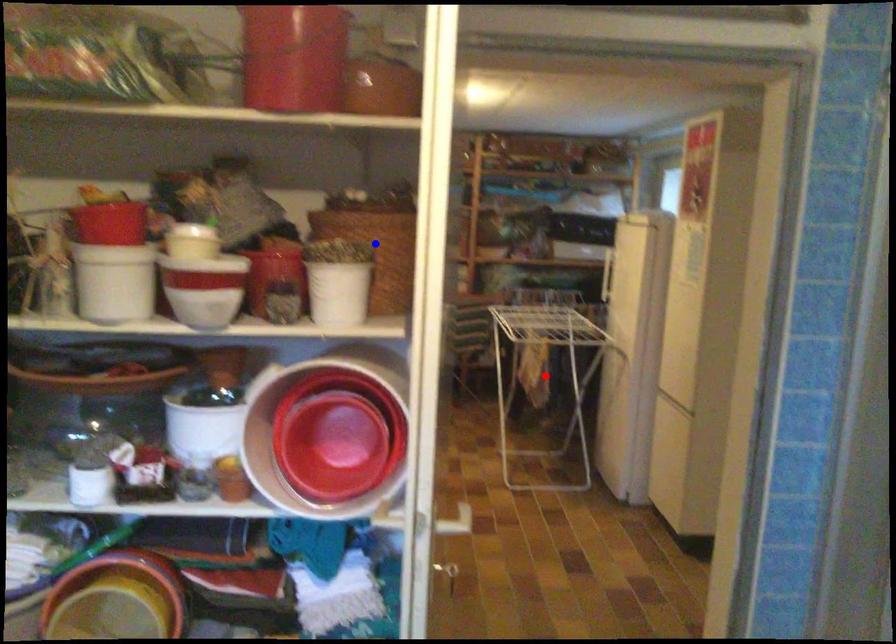
Question: Which of the two points in the image is closer to the camera?

Choices:
 (A) Blue point is closer.
 (B) Red point is closer.

Answer: (A)